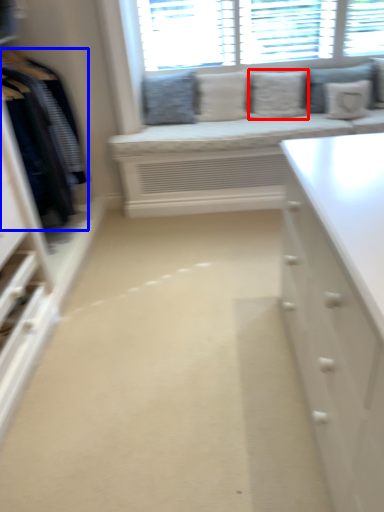
Question: Which object is further to the camera taking this photo, pillow (highlighted by a red box) or clothing (highlighted by a blue box)?

Choices:
 (A) pillow
 (B) clothing

Answer: (A)